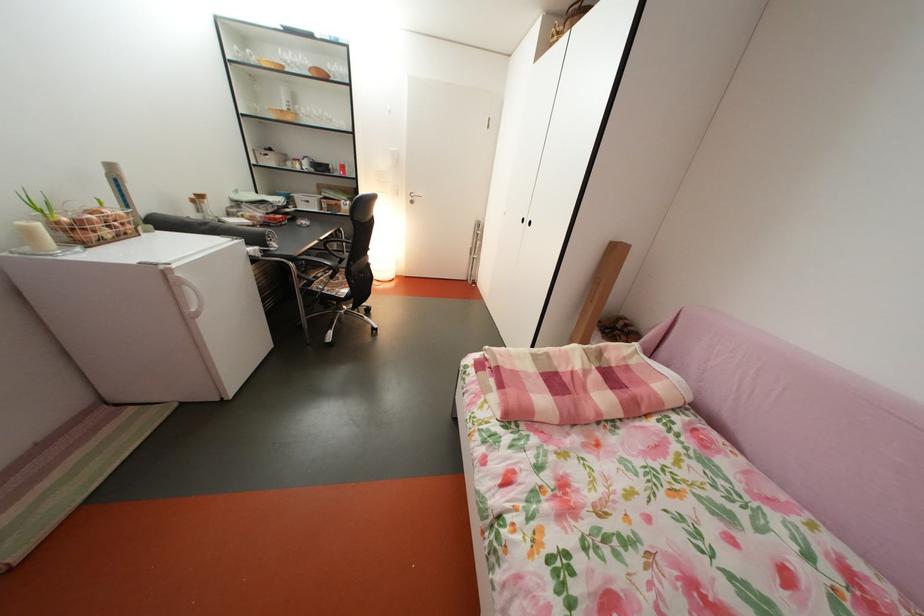
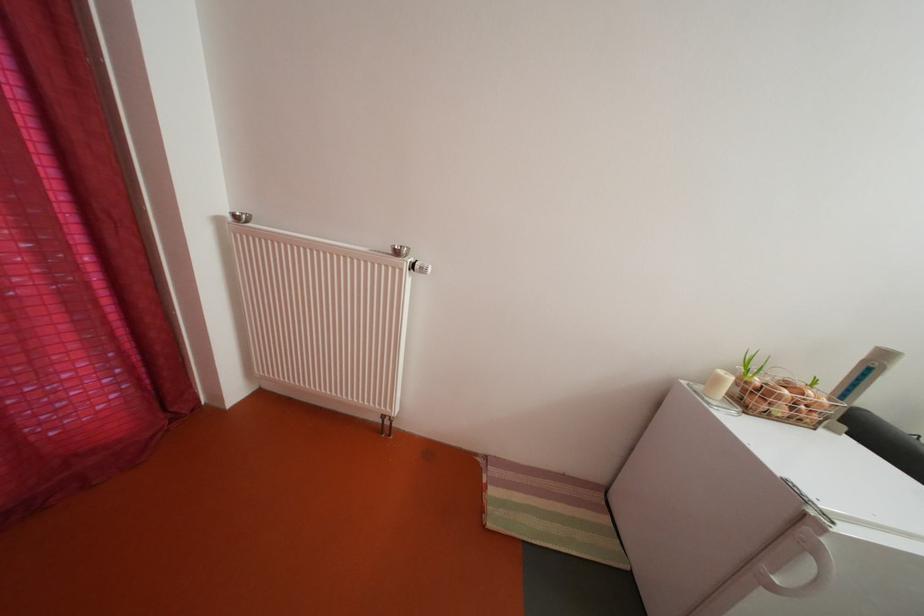
The point at (118,238) is marked in the first image. Where is the corresponding point in the second image?

(792, 416)